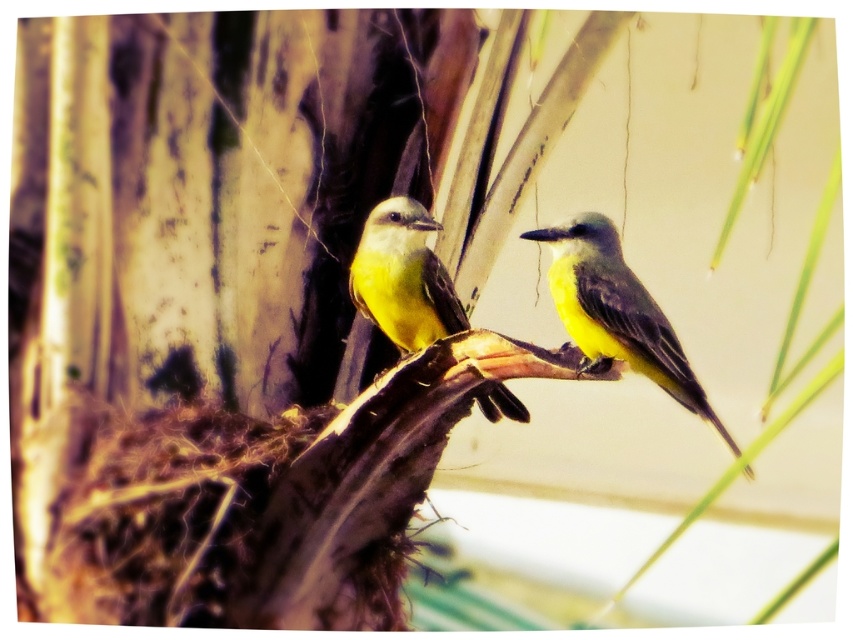
You are a birdwatcher observing two yellow matte birds on a palm frond. The birds are labeled as the yellow matte bird at center and the yellow matte bird at left. Based on their positions, which bird is closer to the bottom of the palm frond?

The yellow matte bird at center is located below the yellow matte bird at left, so it is closer to the bottom of the palm frond.